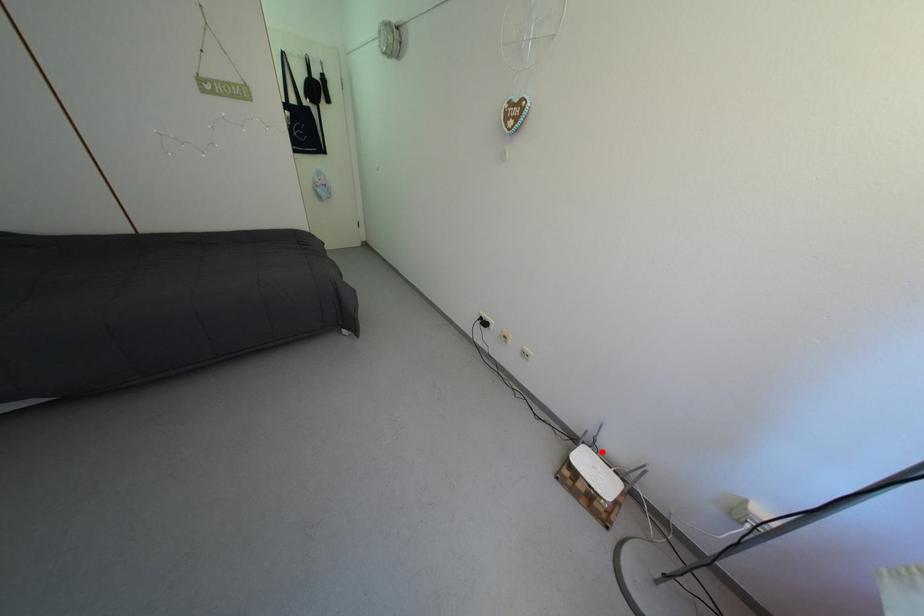
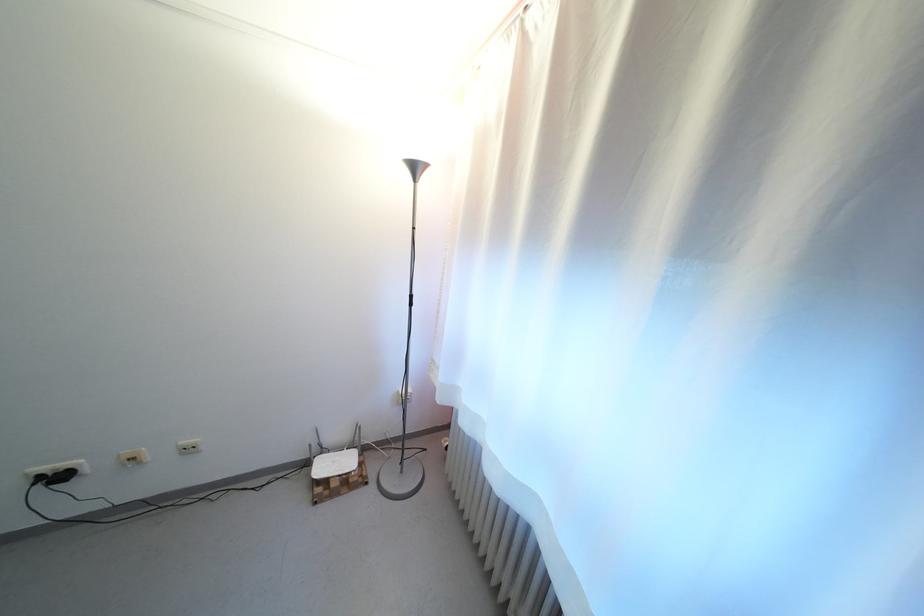
Question: I am providing you with two images of the same scene from different viewpoints. Given a red point in image1, look at the same physical point in image2. Is it:

Choices:
 (A) Closer to the viewpoint
 (B) Farther from the viewpoint

Answer: (B)